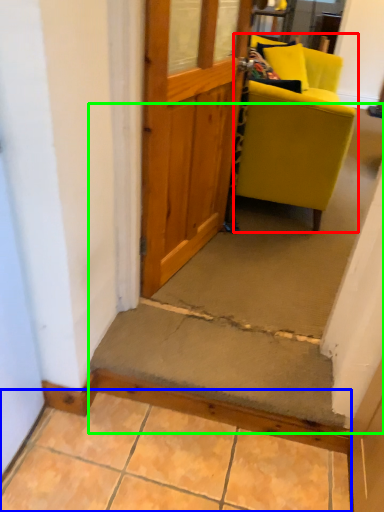
Question: Which object is the closest to the chair (highlighted by a red box)? Choose among these: concrete (highlighted by a blue box) or stairwell (highlighted by a green box).

Choices:
 (A) concrete
 (B) stairwell

Answer: (B)